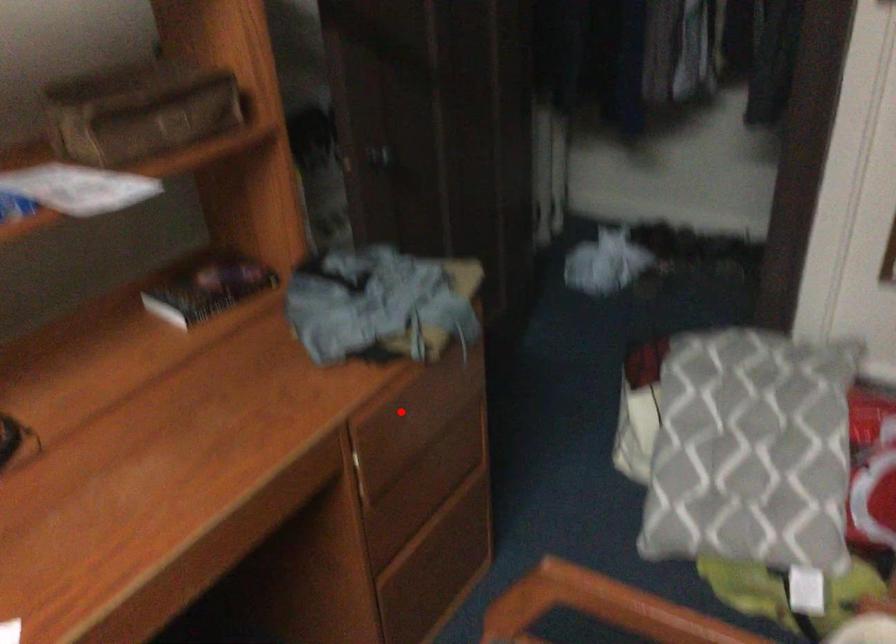
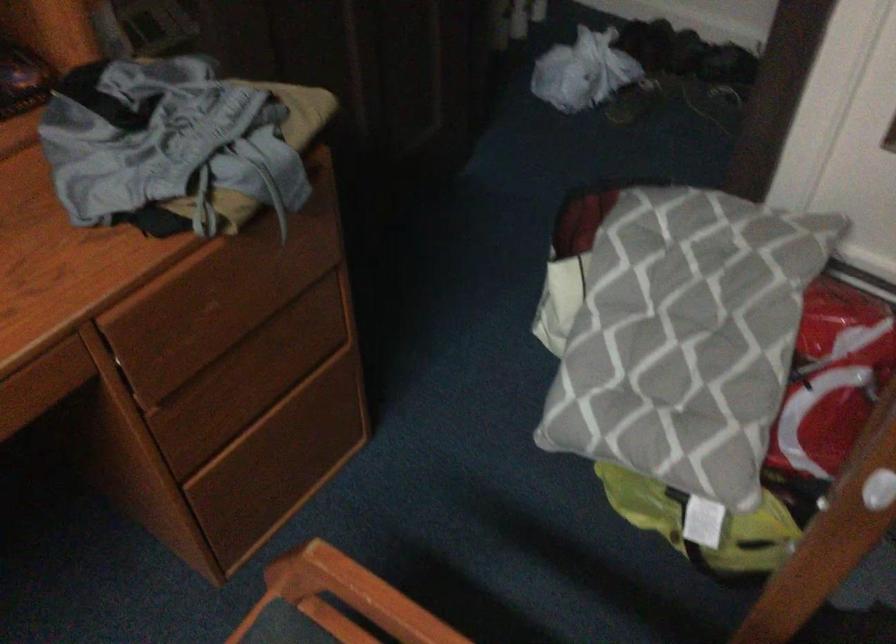
Question: I am providing you with two images of the same scene from different viewpoints. Given a red point in image1, look at the same physical point in image2. Is it:

Choices:
 (A) Closer to the viewpoint
 (B) Farther from the viewpoint

Answer: (A)